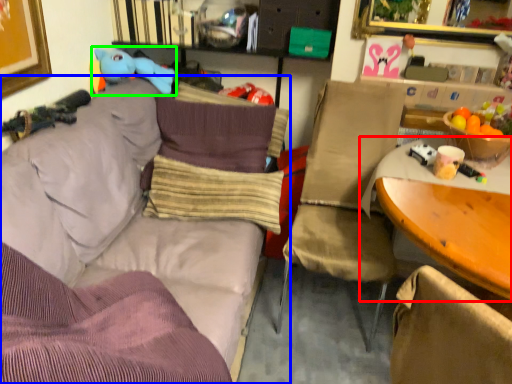
Question: Considering the real-world distances, which object is closest to table (highlighted by a red box)? studio couch (highlighted by a blue box) or toy (highlighted by a green box).

Choices:
 (A) studio couch
 (B) toy

Answer: (A)